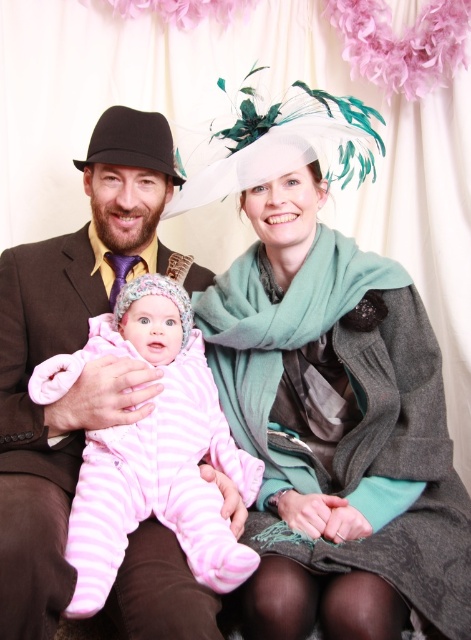
Question: Can you confirm if white matte hat at upper center is positioned to the right of pink fleece onesie at center?

Choices:
 (A) yes
 (B) no

Answer: (A)

Question: Which of the following is the closest to the observer?

Choices:
 (A) (310, 387)
 (B) (146, 339)

Answer: (B)

Question: Is white matte hat at upper center further to the viewer compared to pink fleece onesie at center?

Choices:
 (A) no
 (B) yes

Answer: (B)

Question: Considering the relative positions of white matte hat at upper center and pink fleece onesie at center in the image provided, where is white matte hat at upper center located with respect to pink fleece onesie at center?

Choices:
 (A) left
 (B) right

Answer: (B)